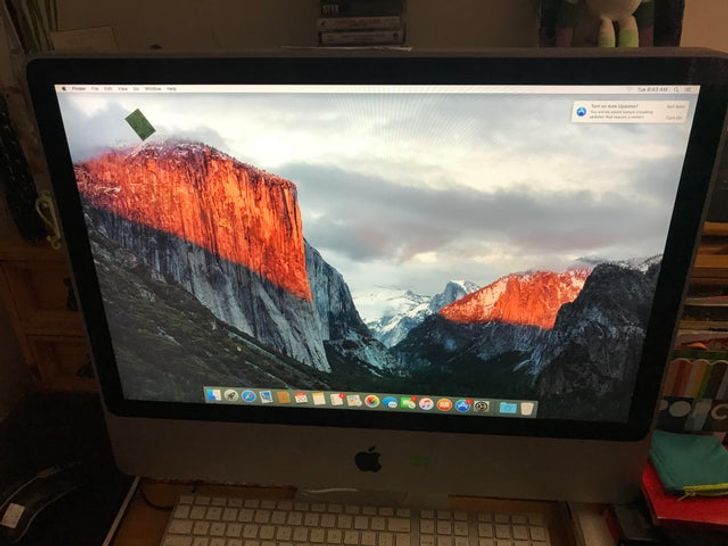
Where is `back wall`? The width and height of the screenshot is (728, 546). back wall is located at coordinates pyautogui.click(x=446, y=28), pyautogui.click(x=193, y=39).